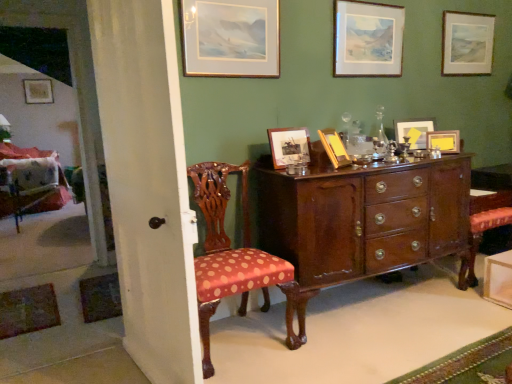
At what (x,y) coordinates should I click in order to perform the action: click on vacant space underneath polished wood cabinet at center (from a real-world perspective). Please return your answer as a coordinate pair (x, y). The width and height of the screenshot is (512, 384). Looking at the image, I should click on (364, 302).